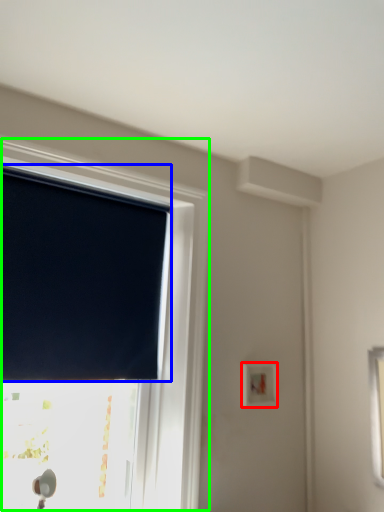
Question: Which object is the farthest from light switch (highlighted by a red box)? Choose among these: window blind (highlighted by a blue box) or window (highlighted by a green box).

Choices:
 (A) window blind
 (B) window

Answer: (A)